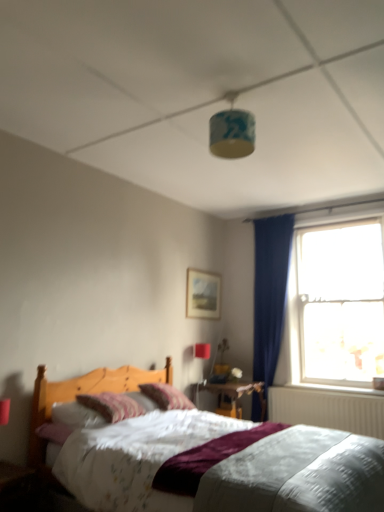
This screenshot has height=512, width=384. Find the location of `vacant space situated above blue fabric lampshade at upper center, acting as the 1th light fixture starting from the top (from a real-world perspective)`. vacant space situated above blue fabric lampshade at upper center, acting as the 1th light fixture starting from the top (from a real-world perspective) is located at coordinates (228, 95).